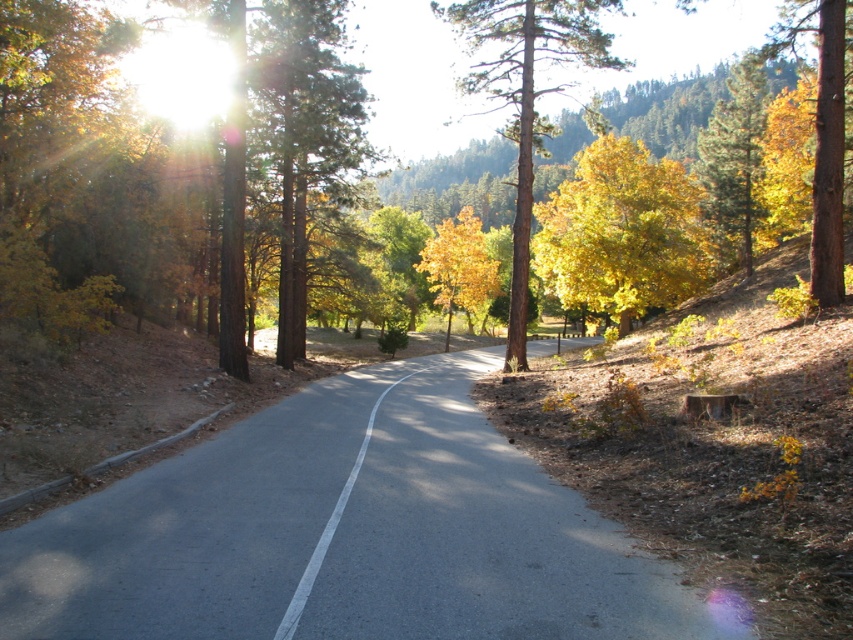
You are driving a car and want to avoid hitting the golden yellow leaves at upper right. Which direction should you steer your car to stay on the asphalt road at center?

The asphalt road at center is in front of golden yellow leaves at upper right, so you should steer your car forward to stay on the asphalt road at center and avoid the golden yellow leaves at upper right.

You are a pedestrian standing on the asphalt road at center. You want to pick up the golden yellow leaves at upper right. Which direction should you walk to reach them?

The golden yellow leaves at upper right are located above the asphalt road at center, so you should walk upward towards the upper right direction to reach them.

You are standing at the center of the road and see the brown textured tree at center. If you walk straight ahead, will you eventually reach the dense forest in the background?

Yes, because the brown textured tree at center is located at point [71,157], which is along the path leading towards the dense forest in the background.